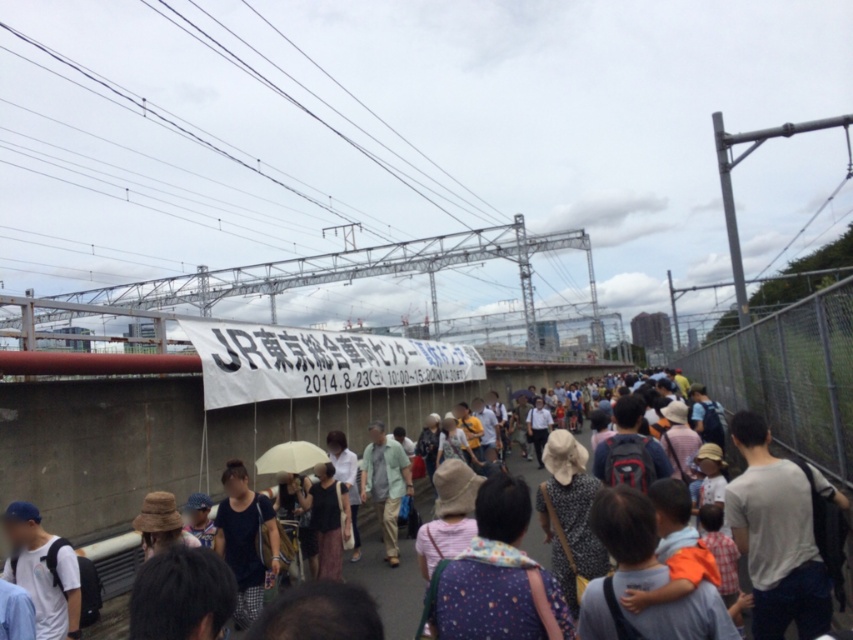
Does light green fabric shirt at center appear on the left side of beige matte umbrella at center?

In fact, light green fabric shirt at center is to the right of beige matte umbrella at center.

Does point (367, 477) lie behind point (318, 454)?

Yes, it is.

What do you see at coordinates (386, 484) in the screenshot?
I see `light green fabric shirt at center` at bounding box center [386, 484].

Locate an element on the screen. The image size is (853, 640). light green fabric shirt at center is located at coordinates click(x=386, y=484).

Consider the image. Is white wire at upper center above beige matte umbrella at center?

Yes, white wire at upper center is above beige matte umbrella at center.

This screenshot has height=640, width=853. What do you see at coordinates (207, 168) in the screenshot?
I see `white wire at upper center` at bounding box center [207, 168].

Is point (427, 205) farther from viewer compared to point (291, 444)?

Yes, it is.

Where is `white wire at upper center`? This screenshot has height=640, width=853. white wire at upper center is located at coordinates (207, 168).

Measure the distance between white wire at upper center and light green fabric shirt at center.

white wire at upper center and light green fabric shirt at center are 60.88 meters apart from each other.

Does point (202, 259) lie behind point (393, 474)?

Yes, point (202, 259) is farther from viewer.

Is point (492, 205) less distant than point (383, 512)?

No, (492, 205) is behind (383, 512).

The width and height of the screenshot is (853, 640). In order to click on white wire at upper center in this screenshot , I will do `click(207, 168)`.